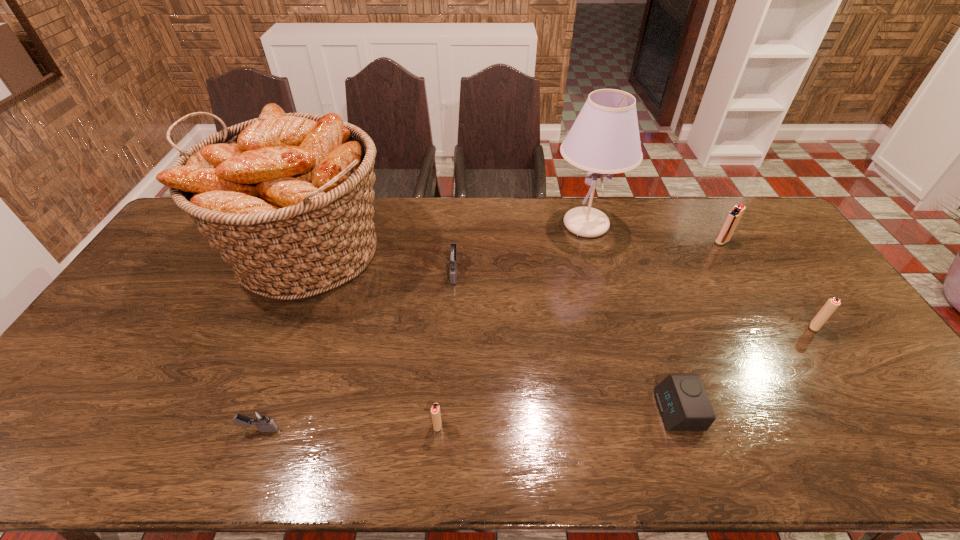
What are the coordinates of `vacant region at the near edge of the desktop` in the screenshot? It's located at (90, 436).

Find the location of `free spot at the left edge of the desktop`. free spot at the left edge of the desktop is located at coordinates (128, 352).

The height and width of the screenshot is (540, 960). In order to click on free space at the right edge of the desktop in this screenshot , I will do `click(811, 292)`.

In the image, there is a desktop. Identify the location of vacant area at the far left corner. This screenshot has width=960, height=540. (176, 231).

In the image, there is a desktop. At what (x,y) coordinates should I click in order to perform the action: click on vacant space at the far right corner. Please return your answer as a coordinate pair (x, y). This screenshot has height=540, width=960. Looking at the image, I should click on (724, 202).

The height and width of the screenshot is (540, 960). Find the location of `free space that is in between the basket and the lampshade`. free space that is in between the basket and the lampshade is located at coordinates (445, 239).

Locate an element on the screen. This screenshot has width=960, height=540. vacant space that is in between the shortest object and the smallest red igniter is located at coordinates (558, 418).

You are a GUI agent. You are given a task and a screenshot of the screen. Output one action in this format:
    pyautogui.click(x=<x>, y=<y>)
    Task: Click on the empty space between the basket and the shortest object
    The image size is (960, 540).
    Given the screenshot: What is the action you would take?
    pyautogui.click(x=492, y=332)

In order to click on free spot between the basket and the third nearest igniter in this screenshot , I will do `click(560, 289)`.

The image size is (960, 540). In order to click on free area in between the basket and the nearest red igniter in this screenshot , I will do `click(372, 339)`.